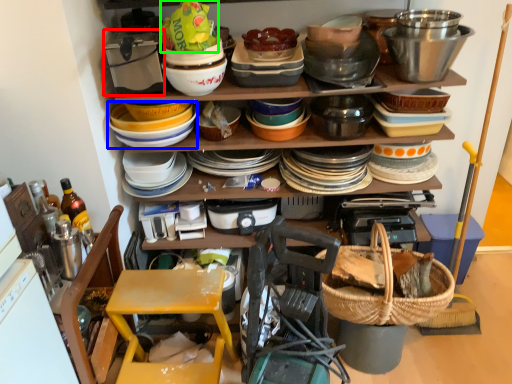
Question: Which is nearer to the appliance (highlighted by a red box)? bowl (highlighted by a blue box) or food (highlighted by a green box).

Choices:
 (A) bowl
 (B) food

Answer: (A)